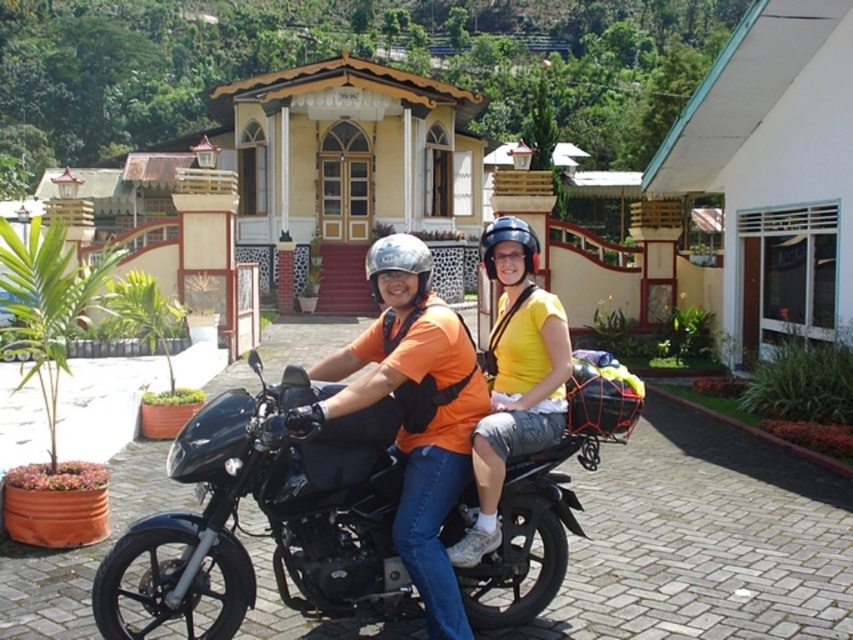
You are a photographer standing 2 meters away from the orange fabric shirt at center and the matte black helmet at center. You want to take a photo of both objects in the same frame. Can you do it without moving your camera? Please explain your reasoning.

The orange fabric shirt at center is 1.21 meters from the matte black helmet at center. Since the distance between them is less than the 2 meters you are away from them, your camera can capture both objects in the same frame without needing to move.

You are a photographer trying to capture a clear shot of the orange fabric shirt at center and the yellow matte helmet at center. Which object should you focus on first if you want to ensure both are in focus, considering their positions?

The orange fabric shirt at center is positioned on the left side of the yellow matte helmet at center. To ensure both are in focus, focus on the orange fabric shirt at center first since it is closer to the left side, allowing the depth of field to cover both objects effectively.